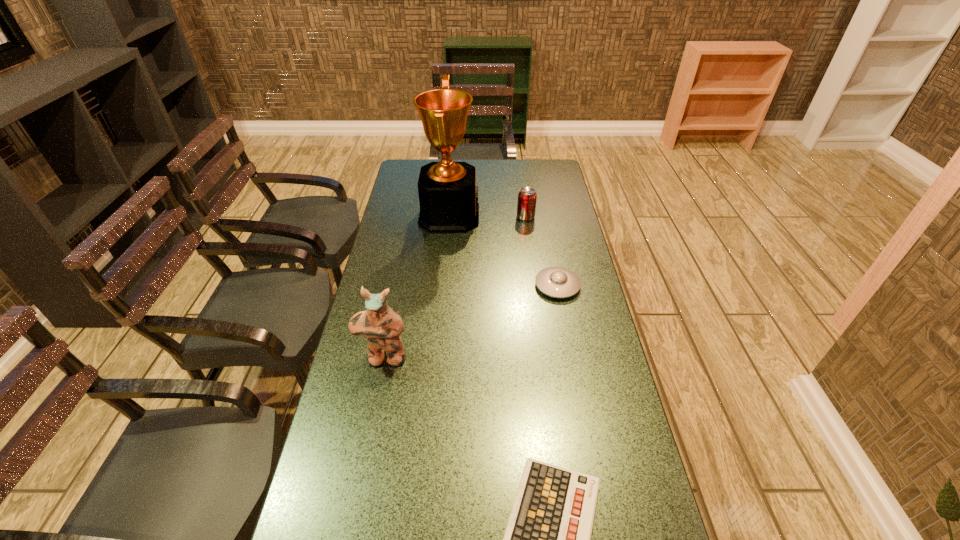
You are a GUI agent. You are given a task and a screenshot of the screen. Output one action in this format:
    pyautogui.click(x=<x>, y=<y>)
    Task: Click on the vacant space that's between the third tallest object and the tallest object
    The width and height of the screenshot is (960, 540).
    Given the screenshot: What is the action you would take?
    488,216

The width and height of the screenshot is (960, 540). Find the location of `object identified as the fourth closest to the fourth shortest object`. object identified as the fourth closest to the fourth shortest object is located at coordinates (526, 205).

Locate an element on the screen. the second closest object to the second shortest object is located at coordinates (526, 205).

Where is `free space that satisfies the following two spatial constraints: 1. on the front side of the soda can; 2. on the left side of the fourth tallest object`? This screenshot has width=960, height=540. free space that satisfies the following two spatial constraints: 1. on the front side of the soda can; 2. on the left side of the fourth tallest object is located at coordinates (535, 286).

Where is `vacant space that satisfies the following two spatial constraints: 1. on the back side of the soda can; 2. on the front of the tallest object with the label`? This screenshot has width=960, height=540. vacant space that satisfies the following two spatial constraints: 1. on the back side of the soda can; 2. on the front of the tallest object with the label is located at coordinates (525, 215).

This screenshot has height=540, width=960. Identify the location of blank area in the image that satisfies the following two spatial constraints: 1. on the front of the trophy cup with the label; 2. on the left side of the third nearest object. (443, 286).